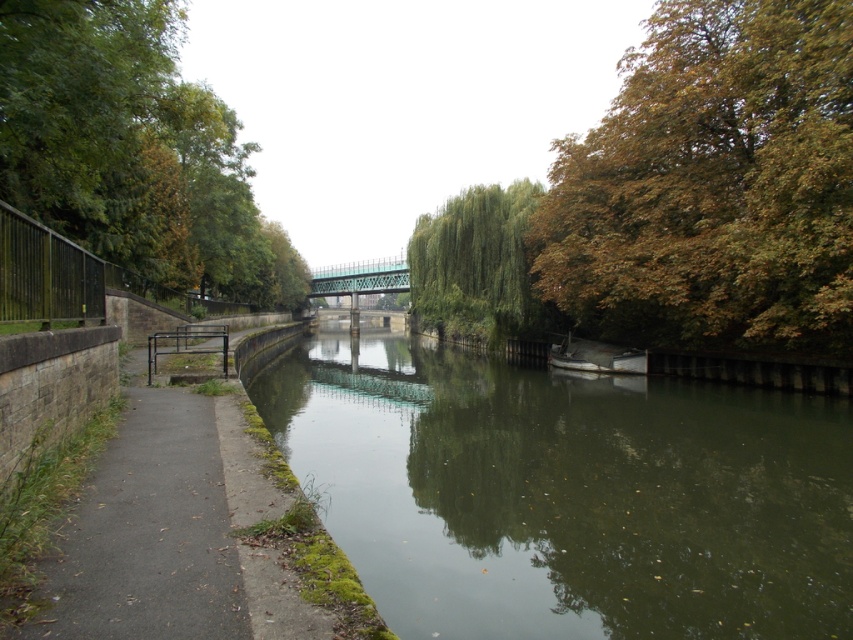
Which is in front, point (357, 534) or point (601, 372)?

Point (357, 534)

Does point (646, 632) lie behind point (604, 364)?

No, (646, 632) is closer to viewer.

Locate an element on the screen. Image resolution: width=853 pixels, height=640 pixels. greenish-brown concrete river at center is located at coordinates (567, 493).

Looking at this image, who is lower down, brown leafy tree at upper right or green leafy tree at center?

green leafy tree at center

Is point (624, 294) behind point (500, 324)?

No, it is not.

You are a GUI agent. You are given a task and a screenshot of the screen. Output one action in this format:
    pyautogui.click(x=<x>, y=<y>)
    Task: Click on the brown leafy tree at upper right
    This screenshot has width=853, height=640.
    Given the screenshot: What is the action you would take?
    pyautogui.click(x=712, y=182)

Which of these two, brown leafy tree at upper right or white matte boat at center, stands taller?

Standing taller between the two is brown leafy tree at upper right.

This screenshot has height=640, width=853. In order to click on brown leafy tree at upper right in this screenshot , I will do (712, 182).

Image resolution: width=853 pixels, height=640 pixels. Identify the location of brown leafy tree at upper right. (712, 182).